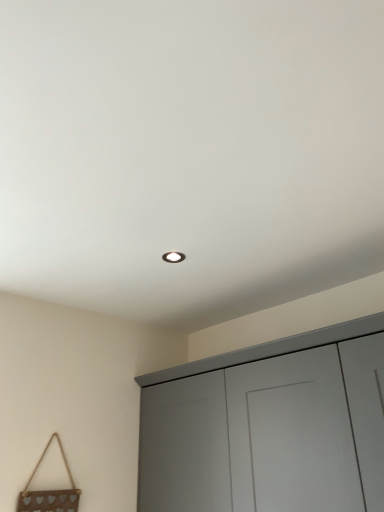
Question: From a real-world perspective, is matte gray cupboard at lower right physically located above or below metallic heart-shaped decoration at lower left?

Choices:
 (A) above
 (B) below

Answer: (A)

Question: Would you say matte gray cupboard at lower right is to the left or to the right of metallic heart-shaped decoration at lower left in the picture?

Choices:
 (A) left
 (B) right

Answer: (B)

Question: Is point (309, 380) closer or farther from the camera than point (16, 505)?

Choices:
 (A) closer
 (B) farther

Answer: (A)

Question: Is metallic heart-shaped decoration at lower left wider or thinner than matte gray cupboard at lower right?

Choices:
 (A) wide
 (B) thin

Answer: (B)

Question: Based on their sizes in the image, would you say metallic heart-shaped decoration at lower left is bigger or smaller than matte gray cupboard at lower right?

Choices:
 (A) small
 (B) big

Answer: (A)

Question: From a real-world perspective, relative to matte gray cupboard at lower right, is metallic heart-shaped decoration at lower left vertically above or below?

Choices:
 (A) below
 (B) above

Answer: (A)

Question: In the image, is metallic heart-shaped decoration at lower left positioned in front of or behind matte gray cupboard at lower right?

Choices:
 (A) front
 (B) behind

Answer: (B)